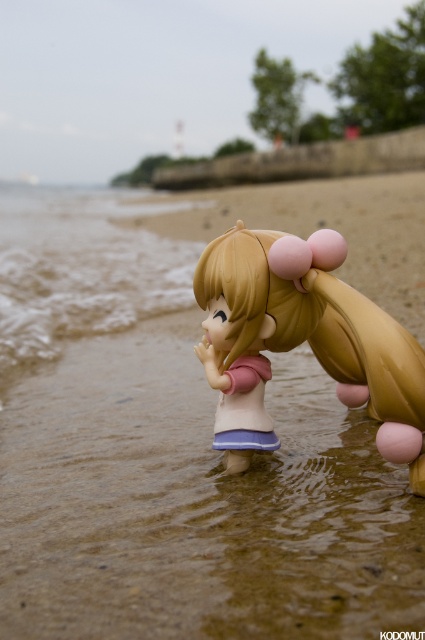
Question: Can you confirm if sandy brown beach at center is positioned to the left of clear water at lower left?

Choices:
 (A) yes
 (B) no

Answer: (B)

Question: Which object is positioned farthest from the clear water at lower left?

Choices:
 (A) satin gold hair at center
 (B) sandy brown beach at center

Answer: (A)

Question: Considering the relative positions of satin gold hair at center and clear water at lower left in the image provided, where is satin gold hair at center located with respect to clear water at lower left?

Choices:
 (A) above
 (B) below

Answer: (B)

Question: Which object appears closest to the camera in this image?

Choices:
 (A) satin gold hair at center
 (B) clear water at lower left

Answer: (A)

Question: Does satin gold hair at center come in front of clear water at lower left?

Choices:
 (A) yes
 (B) no

Answer: (A)

Question: Which of the following is the farthest from the observer?

Choices:
 (A) satin gold hair at center
 (B) clear water at lower left
 (C) sandy brown beach at center

Answer: (B)